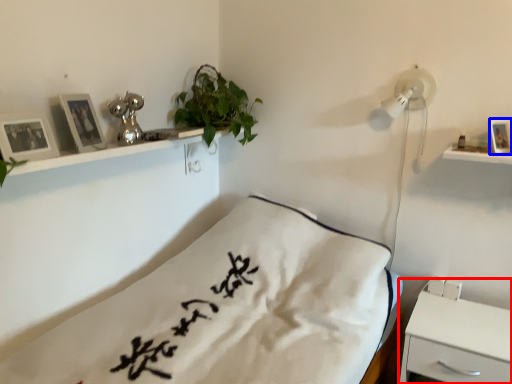
Question: Which of the following is the closest to the observer, nightstand (highlighted by a red box) or picture frame (highlighted by a blue box)?

Choices:
 (A) nightstand
 (B) picture frame

Answer: (A)